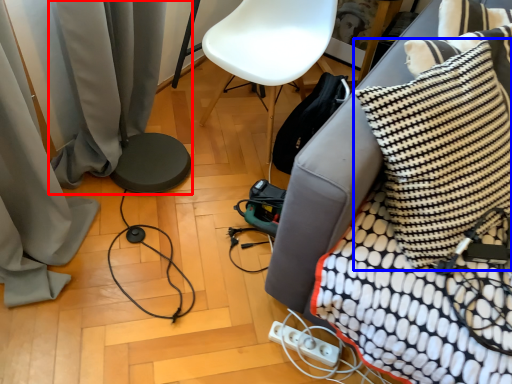
Question: Which object is further to the camera taking this photo, curtain (highlighted by a red box) or pillow (highlighted by a blue box)?

Choices:
 (A) curtain
 (B) pillow

Answer: (A)